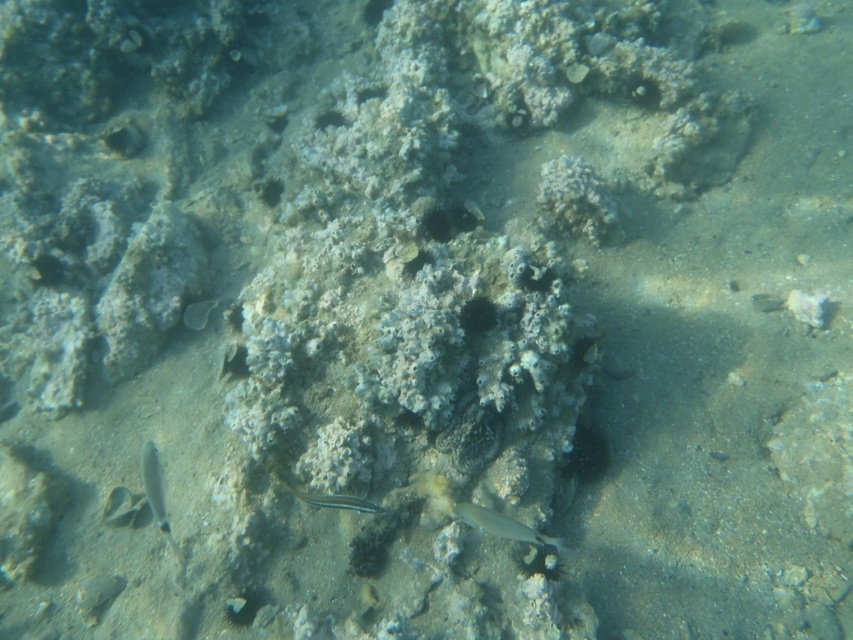
Question: Where is silvery metallic fish at center located in relation to translucent silver fish at lower left in the image?

Choices:
 (A) above
 (B) below

Answer: (B)

Question: Does silvery metallic fish at center appear under translucent silver fish at lower left?

Choices:
 (A) no
 (B) yes

Answer: (B)

Question: Which point appears farthest from the camera in this image?

Choices:
 (A) (151, 445)
 (B) (511, 531)

Answer: (A)

Question: Does silvery metallic fish at center appear under translucent silver fish at lower left?

Choices:
 (A) yes
 (B) no

Answer: (A)

Question: Which point is closer to the camera?

Choices:
 (A) (512, 538)
 (B) (143, 464)

Answer: (A)

Question: Which object appears farthest from the camera in this image?

Choices:
 (A) silvery metallic fish at center
 (B) translucent silver fish at lower left

Answer: (B)